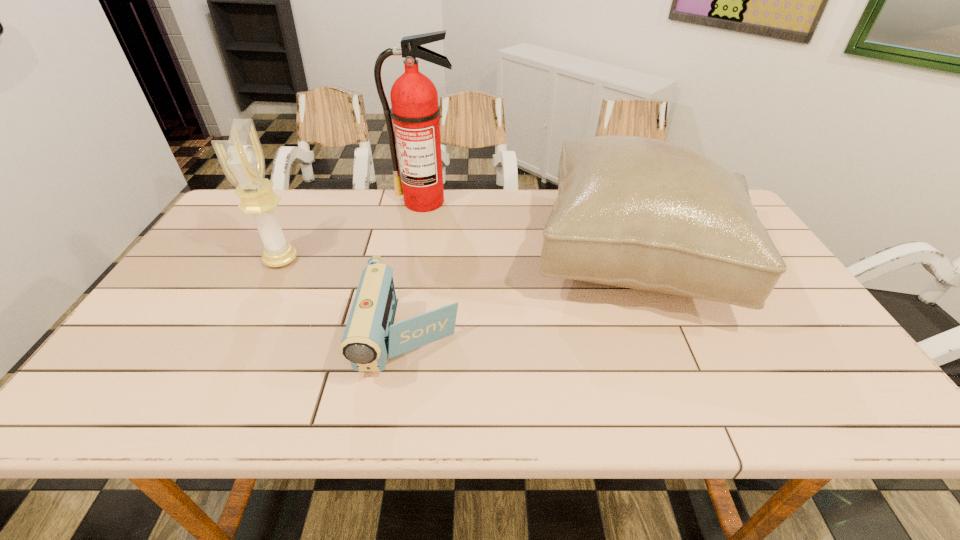
You are a GUI agent. You are given a task and a screenshot of the screen. Output one action in this format:
    pyautogui.click(x=<x>, y=<y>)
    Task: Click on the free space between the third shortest object and the cushion
    The width and height of the screenshot is (960, 540).
    Given the screenshot: What is the action you would take?
    pyautogui.click(x=460, y=260)

Find the location of a particular element. vacant space in between the third tallest object and the fire extinguisher is located at coordinates (532, 231).

You are a GUI agent. You are given a task and a screenshot of the screen. Output one action in this format:
    pyautogui.click(x=<x>, y=<y>)
    Task: Click on the free spot between the tallest object and the cushion
    The image size is (960, 540).
    Given the screenshot: What is the action you would take?
    pyautogui.click(x=532, y=231)

The image size is (960, 540). Identify the location of free space between the cushion and the award. (460, 260).

Image resolution: width=960 pixels, height=540 pixels. Find the location of `free space between the award and the rightmost object`. free space between the award and the rightmost object is located at coordinates (460, 260).

Find the location of `vacant space that is in between the shortest object and the tallest object`. vacant space that is in between the shortest object and the tallest object is located at coordinates (418, 271).

Find the location of a particular element. The width and height of the screenshot is (960, 540). empty space between the fire extinguisher and the shortest object is located at coordinates (418, 271).

Where is `vacant point located between the cushion and the award`? vacant point located between the cushion and the award is located at coordinates (460, 260).

This screenshot has width=960, height=540. Identify the location of vacant area that lies between the leftmost object and the cushion. (460, 260).

Locate an element on the screen. The height and width of the screenshot is (540, 960). free spot between the tallest object and the award is located at coordinates (353, 231).